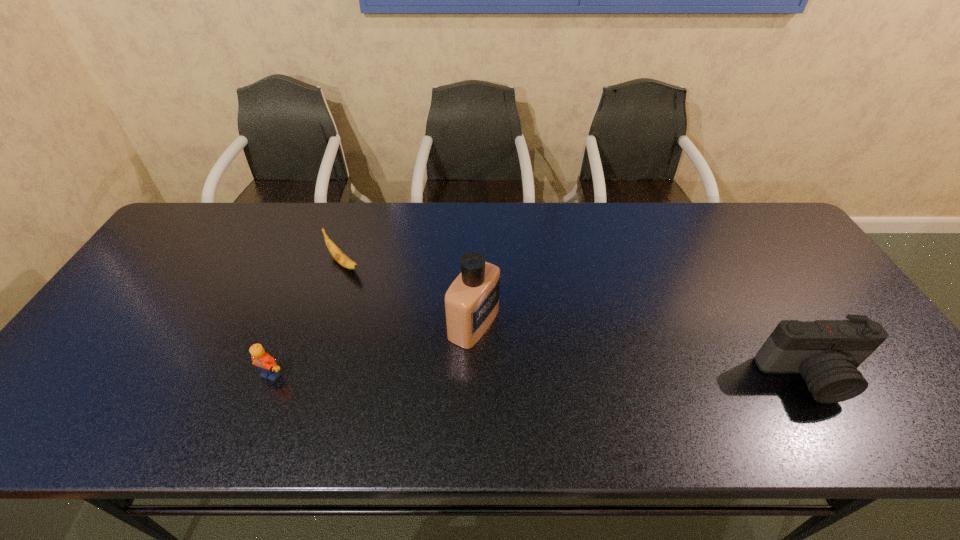
This screenshot has height=540, width=960. I want to click on free space on the desktop that is between the second shortest object and the camera and is positioned on the peel of the farthest object from the top, so coord(468,376).

Find the location of a particular element. free space on the desktop that is between the Lego and the rightmost object and is positioned on the front label of the second farthest object is located at coordinates (588, 376).